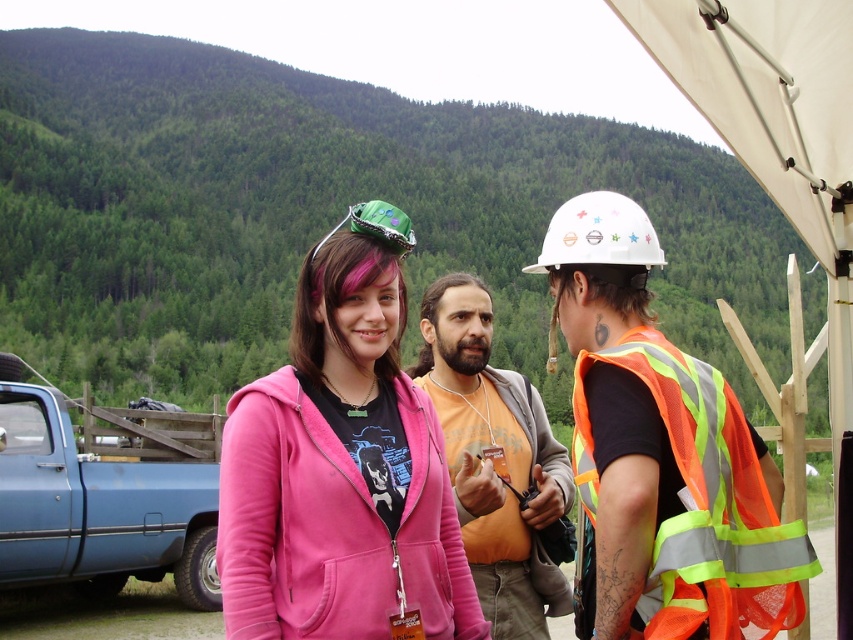
Question: In this image, where is pink fleece jacket at center located relative to white matte hard hat at center?

Choices:
 (A) above
 (B) below

Answer: (B)

Question: Which point is closer to the camera?

Choices:
 (A) white matte hard hat at center
 (B) pink fleece jacket at center

Answer: (B)

Question: Which point is closer to the camera?

Choices:
 (A) (560, 256)
 (B) (235, 481)
 (C) (68, 452)
 (D) (538, 410)

Answer: (B)

Question: Does pink fleece jacket at center appear on the left side of white matte hard hat at center?

Choices:
 (A) no
 (B) yes

Answer: (B)

Question: Which of the following is the farthest from the observer?

Choices:
 (A) blue matte truck at lower left
 (B) pink fleece jacket at center

Answer: (A)

Question: Is pink fleece jacket at center above orange cotton shirt at center?

Choices:
 (A) yes
 (B) no

Answer: (A)